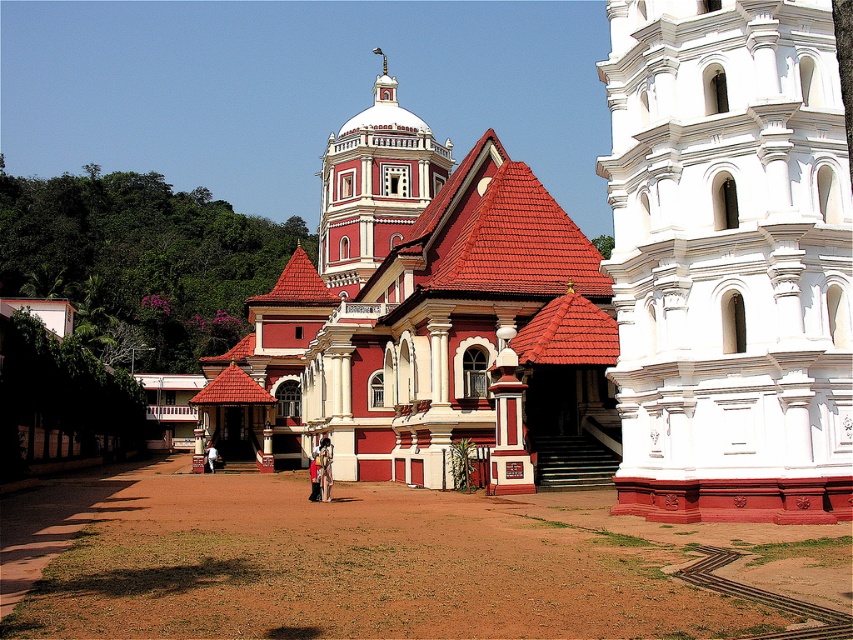
Question: Can you confirm if red matte church at center is positioned below leather jacket at center?

Choices:
 (A) no
 (B) yes

Answer: (A)

Question: Is white stone tower at right wider than red painted dome at center?

Choices:
 (A) no
 (B) yes

Answer: (A)

Question: Which of the following is the closest to the observer?

Choices:
 (A) (316, 448)
 (B) (410, 115)

Answer: (A)

Question: Which of the following is the farthest from the observer?

Choices:
 (A) (312, 467)
 (B) (325, 262)
 (C) (285, 273)
 (D) (647, 10)

Answer: (B)

Question: Estimate the real-world distances between objects in this image. Which object is farther from the red matte church at center?

Choices:
 (A) red fabric person at center
 (B) red painted dome at center

Answer: (A)

Question: Does leather jacket at center appear under dark blue fabric at center?

Choices:
 (A) yes
 (B) no

Answer: (B)